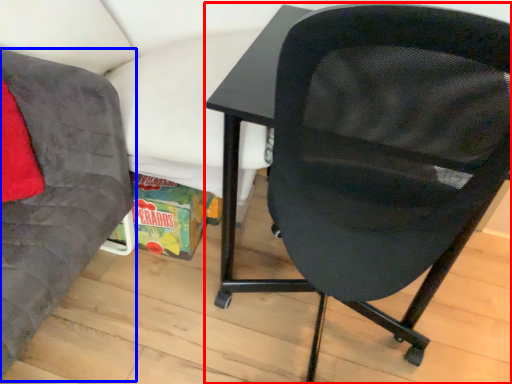
Question: Among these objects, which one is farthest to the camera, chair (highlighted by a red box) or chair (highlighted by a blue box)?

Choices:
 (A) chair
 (B) chair

Answer: (A)